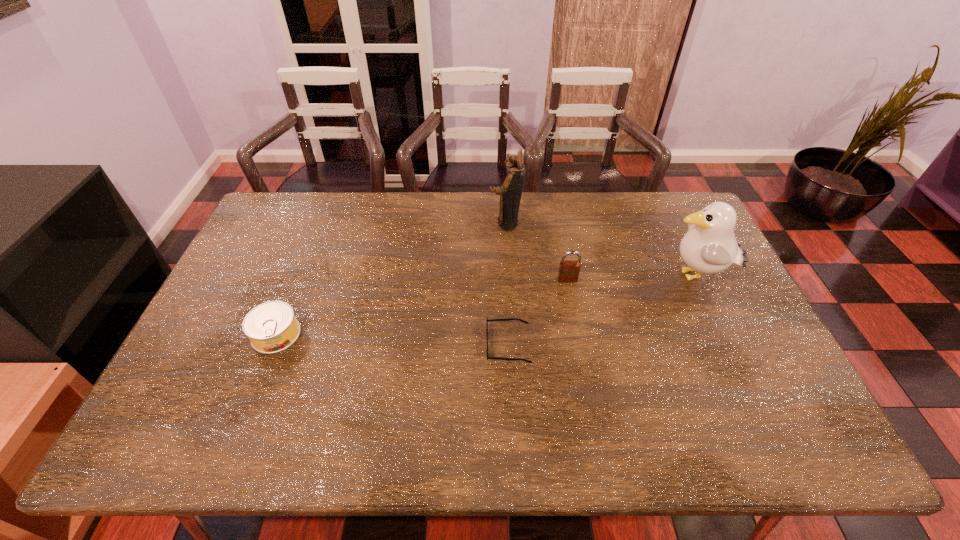
Image resolution: width=960 pixels, height=540 pixels. Find the location of `free space located 0.260m on the beak of the rightmost object`. free space located 0.260m on the beak of the rightmost object is located at coordinates (576, 276).

Image resolution: width=960 pixels, height=540 pixels. In order to click on vacant space situated 0.380m on the beak of the rightmost object in this screenshot , I will do `click(537, 276)`.

You are a GUI agent. You are given a task and a screenshot of the screen. Output one action in this format:
    pyautogui.click(x=<x>, y=<y>)
    Task: Click on the vacant space located 0.250m on the beak of the rightmost object
    
    Given the screenshot: What is the action you would take?
    pyautogui.click(x=579, y=276)

Where is `free spot located 0.100m on the front-facing side of the padlock`? Image resolution: width=960 pixels, height=540 pixels. free spot located 0.100m on the front-facing side of the padlock is located at coordinates (573, 308).

Locate an element on the screen. The width and height of the screenshot is (960, 540). free space located 0.240m on the back of the leftmost object is located at coordinates (306, 258).

Find the location of a particular element. The image size is (960, 540). vacant space located on the front-facing side of the shortest object is located at coordinates (386, 345).

At what (x,y) coordinates should I click in order to perform the action: click on vacant space situated 0.330m on the front-facing side of the shortest object. Please return your answer as a coordinate pair (x, y). This screenshot has width=960, height=540. Looking at the image, I should click on (364, 345).

The image size is (960, 540). What are the coordinates of `free space located 0.240m on the front-facing side of the shortest object` in the screenshot? It's located at (397, 345).

In order to click on object that is at the far edge in this screenshot , I will do `click(510, 192)`.

Image resolution: width=960 pixels, height=540 pixels. I want to click on object that is at the left edge, so click(x=271, y=327).